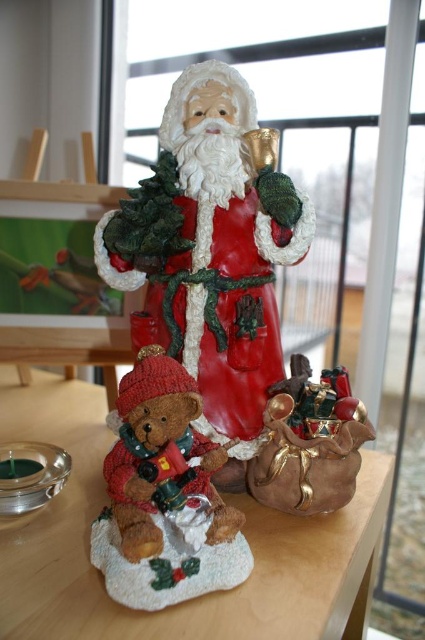
Question: Which object appears closest to the camera in this image?

Choices:
 (A) knitted teddy bear at lower left
 (B) brown matte table at center
 (C) red glossy santa claus at center

Answer: (B)

Question: Is brown matte table at center behind shiny brown leather bag at center?

Choices:
 (A) no
 (B) yes

Answer: (A)

Question: Which object appears closest to the camera in this image?

Choices:
 (A) knitted teddy bear at lower left
 (B) shiny brown leather bag at center
 (C) red glossy santa claus at center
 (D) brown matte table at center

Answer: (D)

Question: Among these points, which one is farthest from the camera?

Choices:
 (A) (116, 500)
 (B) (101, 224)
 (C) (323, 472)
 (D) (36, 566)

Answer: (B)

Question: Does brown matte table at center appear on the right side of shiny brown leather bag at center?

Choices:
 (A) yes
 (B) no

Answer: (B)

Question: Can you confirm if red glossy santa claus at center is positioned above brown matte table at center?

Choices:
 (A) no
 (B) yes

Answer: (B)